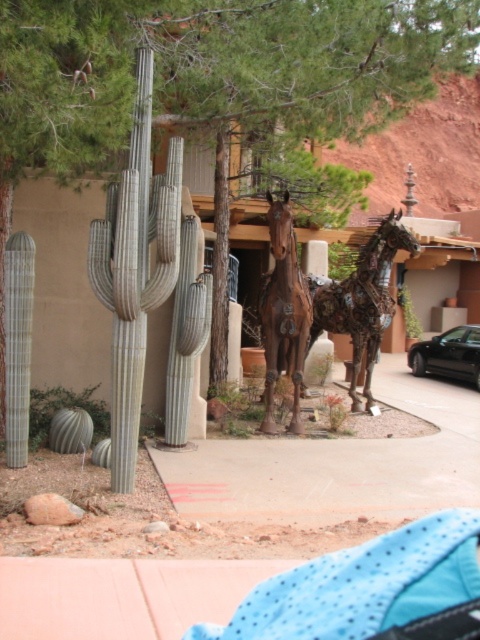
You are standing at the center of the desert scene. There is a point marked at coordinates (134, 268). What object does this point correspond to?

The point at coordinates (134, 268) corresponds to the greenish gray textured cactus at left.

You are standing at the base of the metallic horse sculpture in the desert scene. There are two points marked on the ground, one at coordinates point (272, 403) and another at point (431, 344). Which of these two points is closer to you?

Point (272, 403) is in front of point (431, 344), so it is closer to you.